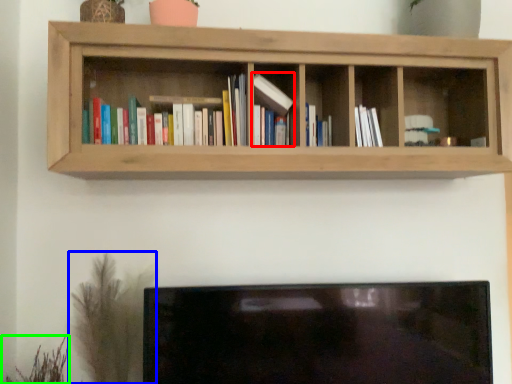
Question: Which object is the farthest from book (highlighted by a red box)? Choose among these: plant (highlighted by a blue box) or plant (highlighted by a green box).

Choices:
 (A) plant
 (B) plant

Answer: (B)